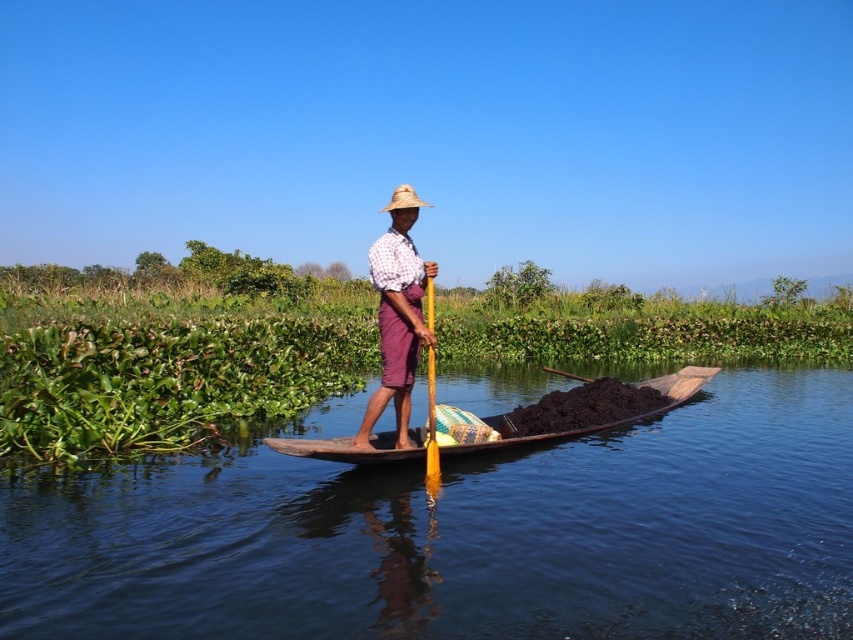
Is point (399, 381) positioned behind point (427, 397)?

No, it is in front of (427, 397).

Consider the image. Does plaid fabric shirt at center have a smaller size compared to yellow wood paddle at center?

Incorrect, plaid fabric shirt at center is not smaller in size than yellow wood paddle at center.

Which is behind, point (387, 346) or point (432, 452)?

The point (432, 452) is more distant.

Where is `plaid fabric shirt at center`? The height and width of the screenshot is (640, 853). plaid fabric shirt at center is located at coordinates (397, 314).

Between point (160, 337) and point (387, 333), which one is positioned in front?

Point (387, 333) is in front.

Find the location of `green leafy plants at center`. green leafy plants at center is located at coordinates (170, 365).

Who is more forward, (x=62, y=346) or (x=392, y=353)?

Point (x=392, y=353) is in front.

The image size is (853, 640). What are the coordinates of `green leafy plants at center` in the screenshot? It's located at (170, 365).

Does point (555, 381) lie behind point (624, 420)?

That is True.

Consider the image. Does brown wooden boat at center appear on the right side of wooden canoe at center?

Incorrect, brown wooden boat at center is not on the right side of wooden canoe at center.

Is point (41, 540) closer to viewer compared to point (491, 442)?

That is True.

Where is `brown wooden boat at center`? brown wooden boat at center is located at coordinates (466, 536).